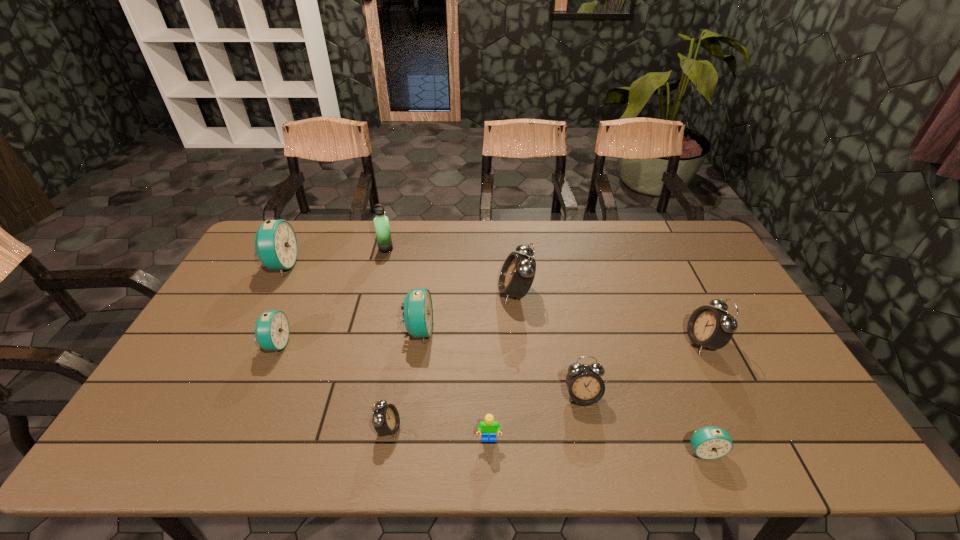
Find the location of a particular element. The width and height of the screenshot is (960, 540). vacant space at the far right corner is located at coordinates 677,252.

At what (x,y) coordinates should I click in order to perform the action: click on vacant point at the near right corner. Please return your answer as a coordinate pair (x, y). This screenshot has width=960, height=540. Looking at the image, I should click on (828, 434).

Image resolution: width=960 pixels, height=540 pixels. Identify the location of free space between the fifth alarm clock from left to right and the leftmost white alarm clock. (452, 360).

Find the location of a particular element. vacant area between the leftmost alarm clock and the second blue alarm clock from left to right is located at coordinates (278, 305).

I want to click on free space between the nearest white alarm clock and the leftmost object, so pos(335,347).

In order to click on free space between the leftmost white alarm clock and the rightmost blue alarm clock in this screenshot , I will do `click(546, 439)`.

The image size is (960, 540). Identify the location of empty location between the rightmost white alarm clock and the leftmost alarm clock. (492, 303).

At what (x,y) coordinates should I click in order to perform the action: click on free spot between the smallest blue alarm clock and the leftmost object. Please return your answer as a coordinate pair (x, y). The image size is (960, 540). Looking at the image, I should click on (492, 358).

Locate an element on the screen. Image resolution: width=960 pixels, height=540 pixels. empty space that is in between the ninth object from right to left and the Lego is located at coordinates (383, 392).

You are a GUI agent. You are given a task and a screenshot of the screen. Output one action in this format:
    pyautogui.click(x=<x>, y=<y>)
    Task: Click on the vacant space in between the green Lego and the nearest white alarm clock
    The height and width of the screenshot is (540, 960).
    Given the screenshot: What is the action you would take?
    [439, 434]